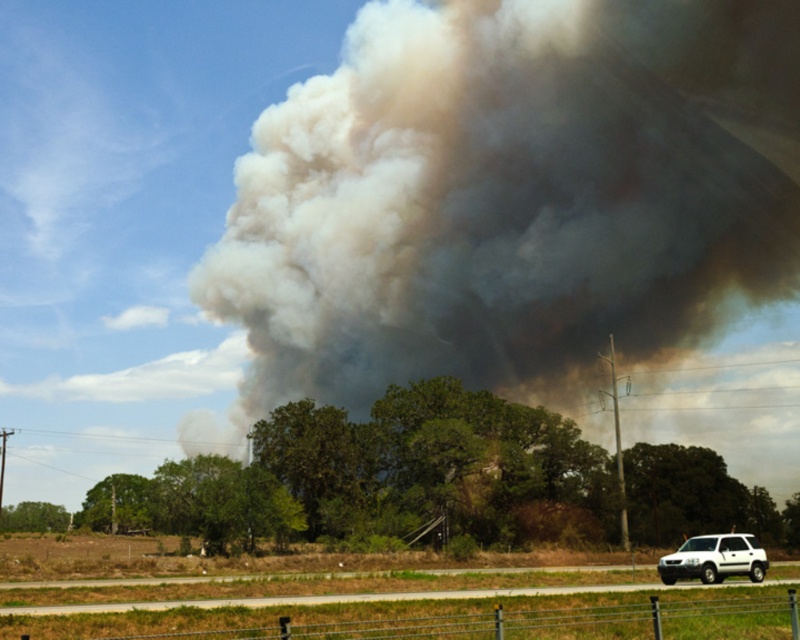
Between gray/dense smoke at center and white matte suv at lower right, which one is positioned lower?

white matte suv at lower right

Is point (684, 294) farther from viewer compared to point (666, 556)?

Yes.

The width and height of the screenshot is (800, 640). In order to click on gray/dense smoke at center in this screenshot , I will do `click(512, 195)`.